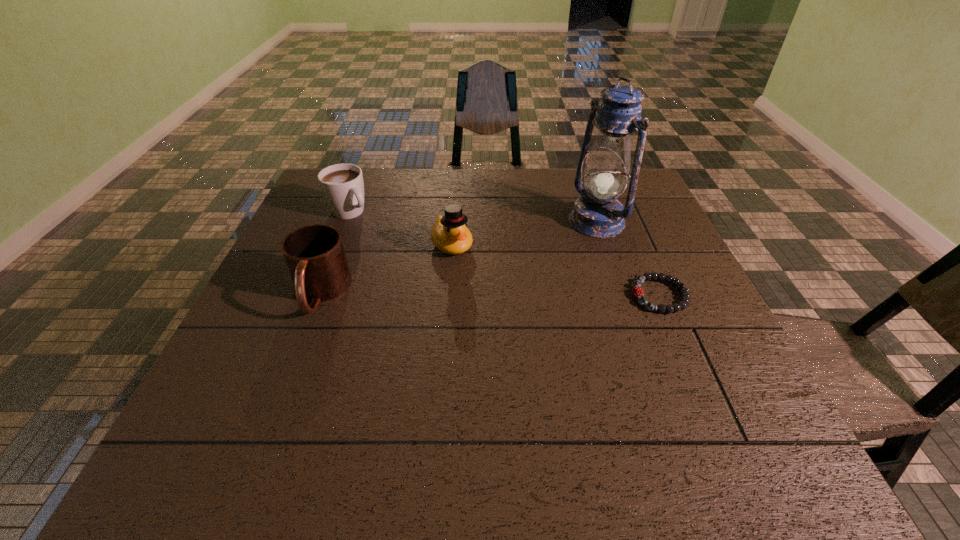
Locate an element on the screen. This screenshot has height=540, width=960. mug is located at coordinates (315, 256).

The image size is (960, 540). What are the coordinates of `bracelet` in the screenshot? It's located at (637, 291).

Where is `cappuccino`? cappuccino is located at coordinates (342, 185).

The height and width of the screenshot is (540, 960). In order to click on duck in this screenshot , I will do `click(450, 234)`.

In order to click on the tallest object in this screenshot , I will do `click(597, 213)`.

Where is `vacant space located on the side of the mug with the handle`? vacant space located on the side of the mug with the handle is located at coordinates (300, 350).

Image resolution: width=960 pixels, height=540 pixels. I want to click on free region located 0.300m on the left of the shortest object, so point(504,295).

Locate an element on the screen. The image size is (960, 540). vacant space located 0.230m with the handle on the side of the cappuccino is located at coordinates (411, 258).

At what (x,y) coordinates should I click in order to perform the action: click on vacant space situated 0.090m with the handle on the side of the cappuccino. Please return your answer as a coordinate pair (x, y). The image size is (960, 540). Looking at the image, I should click on (380, 235).

Where is `vacant space located 0.100m with the handle on the side of the cappuccino`? Image resolution: width=960 pixels, height=540 pixels. vacant space located 0.100m with the handle on the side of the cappuccino is located at coordinates (382, 237).